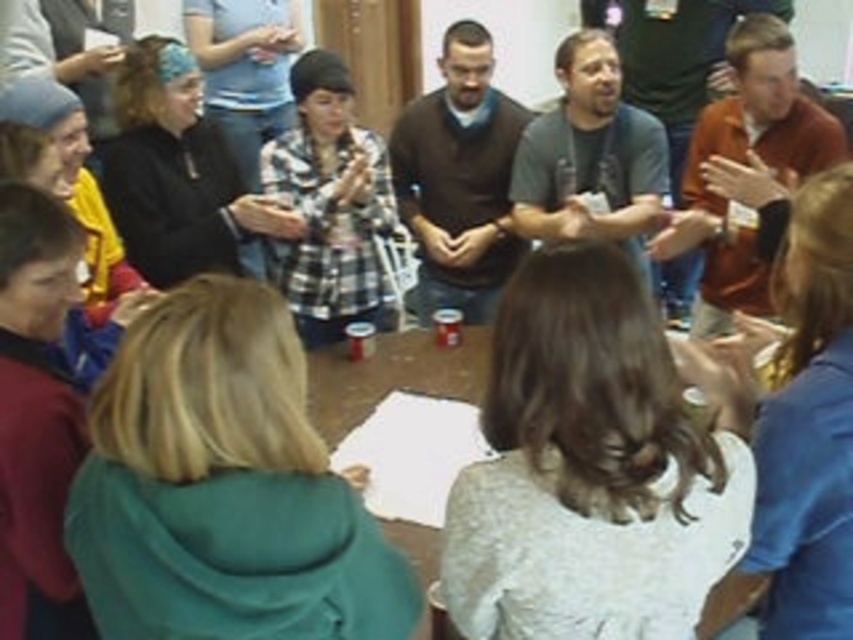
Question: Is green fleece jacket at lower left to the right of white textured sweater at center from the viewer's perspective?

Choices:
 (A) yes
 (B) no

Answer: (B)

Question: Considering the relative positions of green fleece jacket at lower left and maroon fleece jacket at lower left in the image provided, where is green fleece jacket at lower left located with respect to maroon fleece jacket at lower left?

Choices:
 (A) left
 (B) right

Answer: (B)

Question: Which of the following is the farthest from the observer?

Choices:
 (A) (508, 225)
 (B) (299, 492)
 (C) (4, 458)
 (D) (554, 419)

Answer: (A)

Question: Does white textured sweater at center appear on the right side of blue fabric shirt at upper right?

Choices:
 (A) yes
 (B) no

Answer: (B)

Question: Estimate the real-world distances between objects in this image. Which object is farther from the brown sweater at center?

Choices:
 (A) maroon fleece jacket at lower left
 (B) green fleece jacket at lower left
 (C) blue fabric shirt at upper right

Answer: (B)

Question: Which point is closer to the camera?

Choices:
 (A) white textured sweater at center
 (B) blue fabric shirt at upper right

Answer: (A)